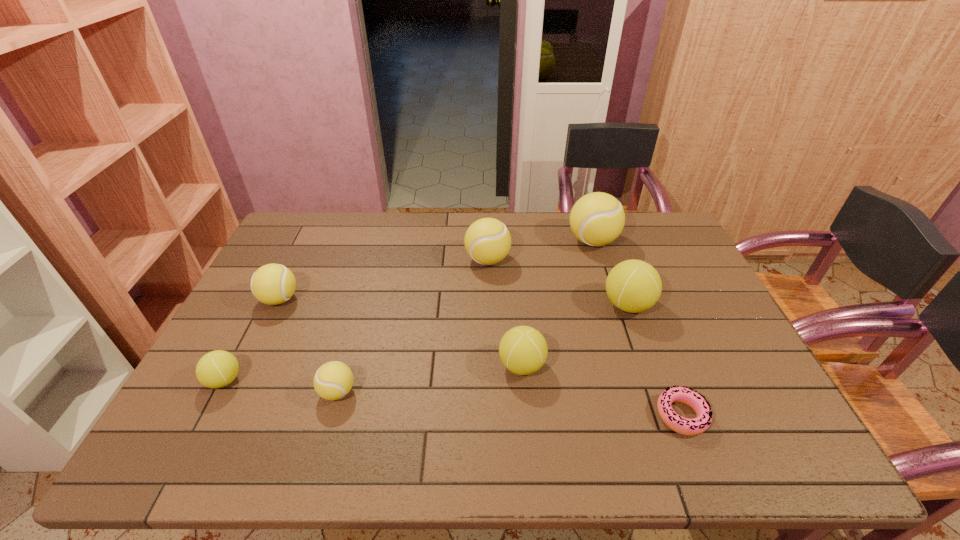
This screenshot has width=960, height=540. What are the coordinates of `the leftmost green tennis ball` in the screenshot? It's located at (218, 368).

Image resolution: width=960 pixels, height=540 pixels. What are the coordinates of `the shortest object` in the screenshot? It's located at (690, 427).

The image size is (960, 540). What are the coordinates of `doughnut` in the screenshot? It's located at [x=690, y=427].

This screenshot has width=960, height=540. Find the location of `vacant area situated on the front of the tallest object`. vacant area situated on the front of the tallest object is located at coordinates (628, 352).

The image size is (960, 540). I want to click on vacant space located on the left of the second biggest yellow tennis ball, so click(x=397, y=260).

At what (x,y) coordinates should I click in order to perform the action: click on blank area located on the front of the farthest green tennis ball. Please return your answer as a coordinate pair (x, y). Image resolution: width=960 pixels, height=540 pixels. Looking at the image, I should click on (642, 346).

Locate an element on the screen. This screenshot has height=540, width=960. vacant space situated 0.220m on the right of the leftmost yellow tennis ball is located at coordinates 374,299.

Find the location of a particular element. This screenshot has height=540, width=960. free space located on the right of the second smallest green tennis ball is located at coordinates (666, 366).

Identify the location of vacant space located 0.290m on the left of the sixth object from right to left. The height and width of the screenshot is (540, 960). (199, 392).

Locate an element on the screen. This screenshot has width=960, height=540. vacant space positioned 0.330m on the right of the smallest green tennis ball is located at coordinates (375, 380).